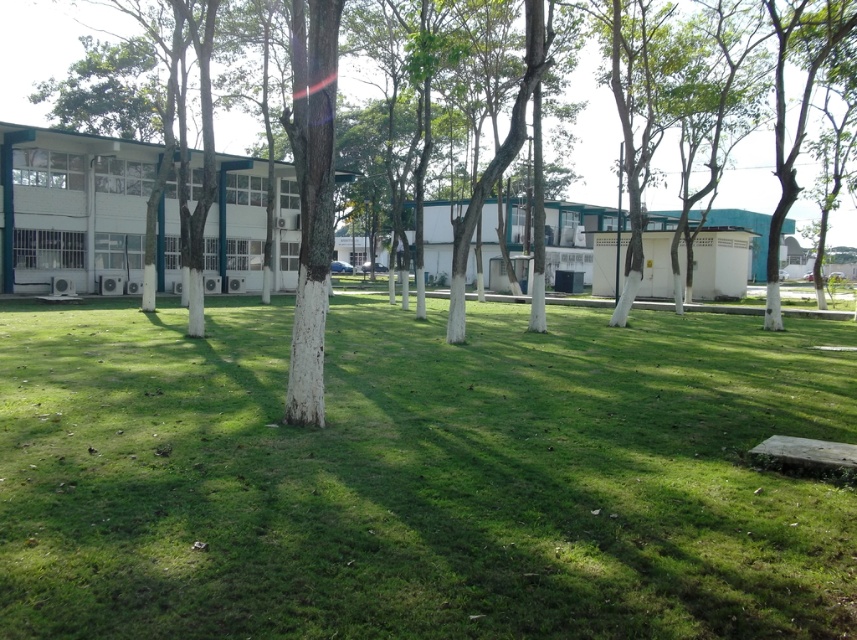
You are standing at point [418,476] in the image. What is the immediate ground surface material beneath your feet?

The immediate ground surface material beneath your feet at point [418,476] is green grass at center.

You are planning to place a picnic blanket on the green grass at center and the white textured tree at center. Which area would allow you to spread the blanket more comfortably?

The white textured tree at center occupies more space than the green grass at center, so you can spread the picnic blanket more comfortably there.

You are standing at the point with coordinates 0.745, 0.489. Looking around, you see the green grass at center. What is directly beneath your feet?

The green grass at center is directly beneath your feet at point (418, 476).